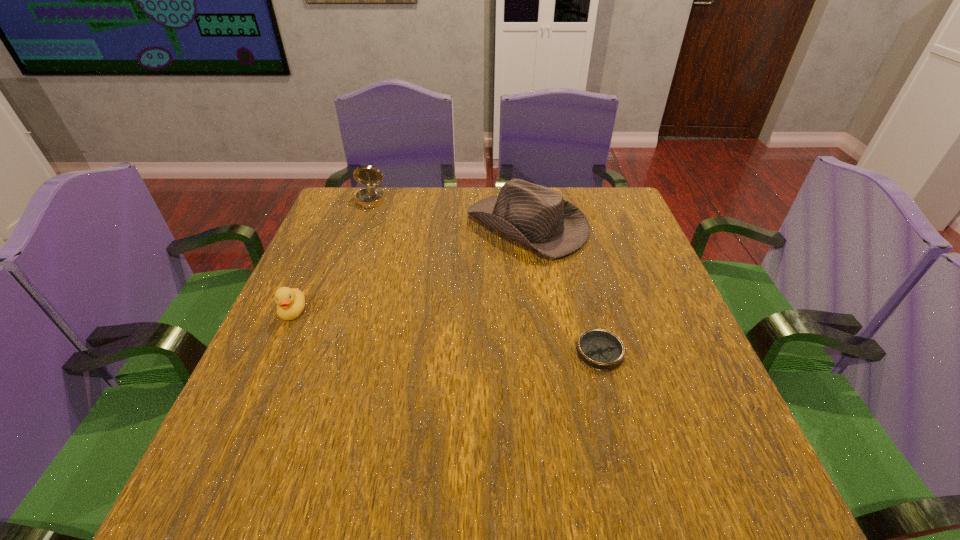
The width and height of the screenshot is (960, 540). Identify the location of vacant space at the left edge of the desktop. coord(330,327).

Locate an element on the screen. The height and width of the screenshot is (540, 960). vacant position at the right edge of the desktop is located at coordinates (671, 377).

What are the coordinates of `vacant space at the far left corner of the desktop` in the screenshot? It's located at (353, 199).

The height and width of the screenshot is (540, 960). In order to click on vacant space that's between the taller compass and the fedora in this screenshot , I will do `click(448, 214)`.

The height and width of the screenshot is (540, 960). In order to click on vacant space in between the fedora and the taller compass in this screenshot , I will do `click(448, 214)`.

The image size is (960, 540). I want to click on empty space between the fedora and the shortest object, so click(564, 289).

Identify the location of free spot between the third farthest object and the second object from left to right. The image size is (960, 540). (331, 257).

The height and width of the screenshot is (540, 960). Identify the location of free space between the third object from right to left and the second shortest object. (331, 257).

Identify the location of vacant area that lies between the fedora and the second shortest object. (410, 269).

Locate an element on the screen. This screenshot has width=960, height=540. blank region between the farther compass and the fedora is located at coordinates (448, 214).